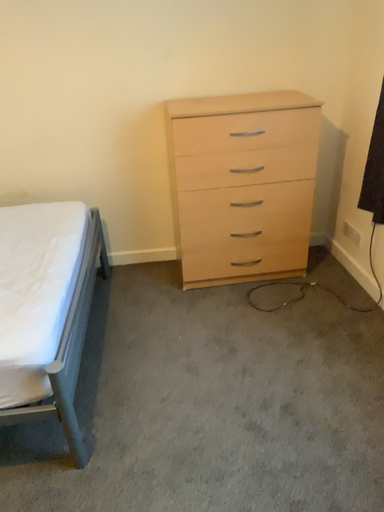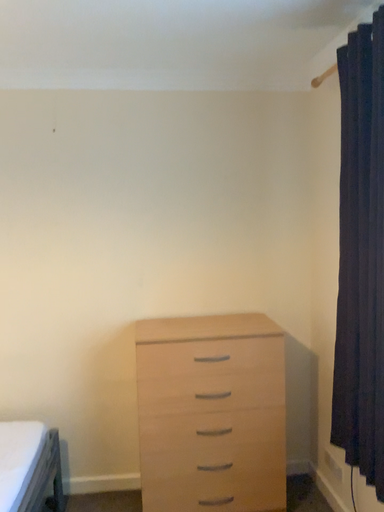
Question: How did the camera likely rotate when shooting the video?

Choices:
 (A) rotated upward
 (B) rotated downward

Answer: (A)